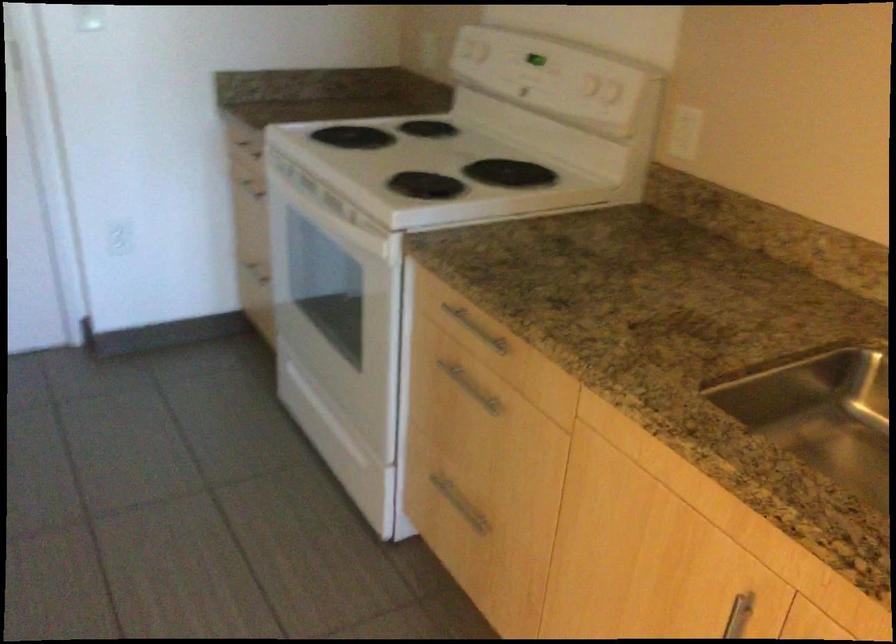
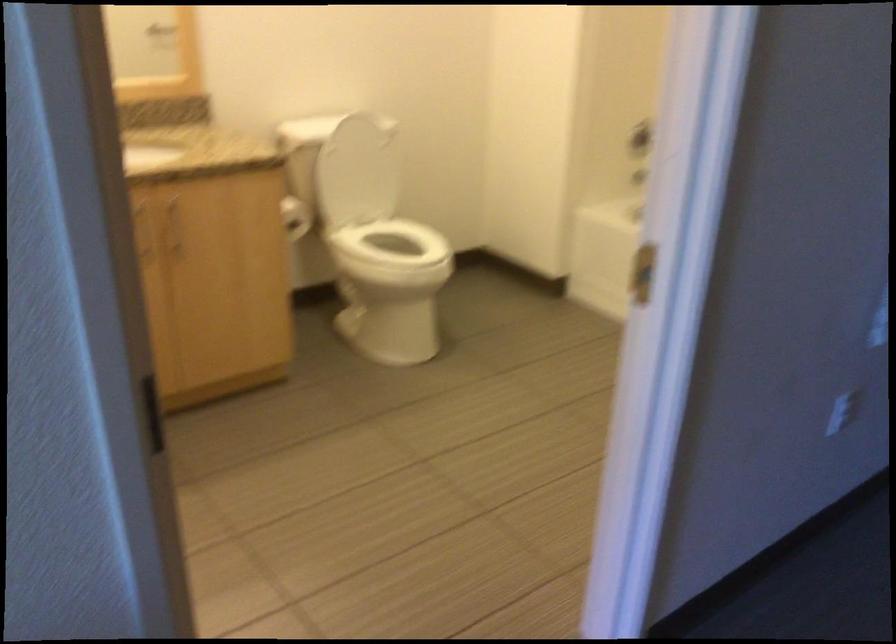
Question: The images are taken continuously from a first-person perspective. In which direction is your viewpoint rotating?

Choices:
 (A) Left
 (B) Right
 (C) Up
 (D) Down

Answer: (A)